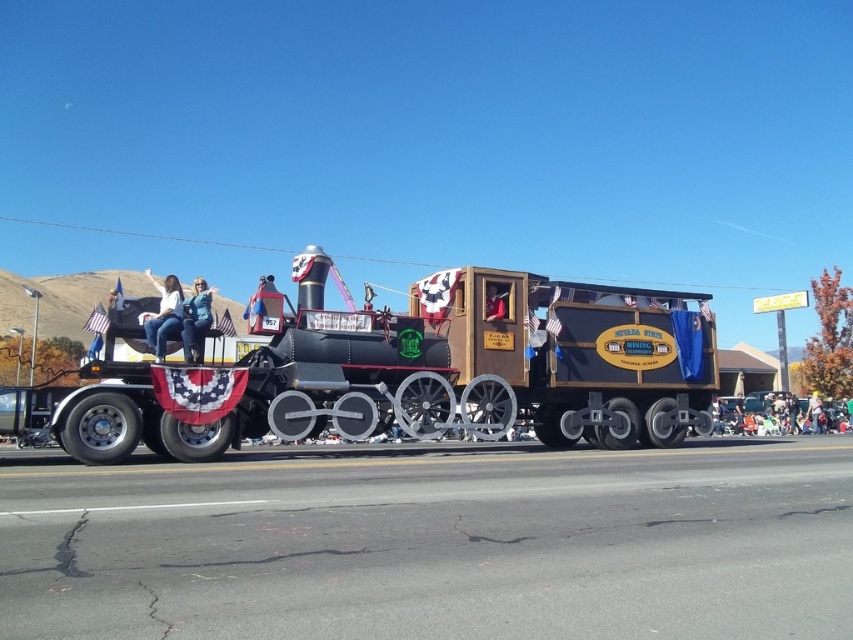
What is the spatial location of the red fabric at center in the image coordinate system?

The red fabric at center is located at point coordinates of (492, 304).

You are standing in front of the parade float and see a point marked at coordinates (492, 304). What color is the fabric at this point?

The fabric at point (492, 304) is red.

You are a photographer positioned at the front of the Nevada State Mining parade float. You want to take a photo that includes both the white fabric pants at left and the light brown leather jacket at center. Given that your camera has a maximum focus range of 25 meters, will you be able to capture both subjects in focus?

The distance between the white fabric pants at left and the light brown leather jacket at center is 27.51 meters. Since the camera can only focus up to 25 meters, it won not be able to capture both subjects in focus simultaneously.